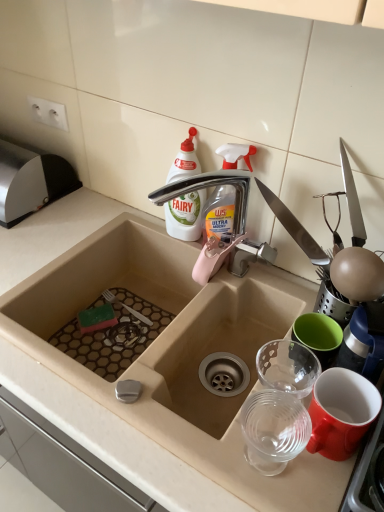
Question: From a real-world perspective, is white plastic bottle at upper center located higher than silver metallic tap at upper center?

Choices:
 (A) yes
 (B) no

Answer: (A)

Question: Is white plastic bottle at upper center touching silver metallic tap at upper center?

Choices:
 (A) yes
 (B) no

Answer: (A)

Question: Can you confirm if white plastic bottle at upper center is smaller than silver metallic tap at upper center?

Choices:
 (A) no
 (B) yes

Answer: (B)

Question: From a real-world perspective, is white plastic bottle at upper center located beneath silver metallic tap at upper center?

Choices:
 (A) no
 (B) yes

Answer: (A)

Question: Does white plastic bottle at upper center contain silver metallic tap at upper center?

Choices:
 (A) yes
 (B) no

Answer: (B)

Question: Which is correct: beige ceramic sink at center is inside white plastic bottle at upper center, or outside of it?

Choices:
 (A) inside
 (B) outside

Answer: (B)

Question: In the image, is beige ceramic sink at center on the left side or the right side of white plastic bottle at upper center?

Choices:
 (A) left
 (B) right

Answer: (A)

Question: From the image's perspective, is beige ceramic sink at center located above or below white plastic bottle at upper center?

Choices:
 (A) above
 (B) below

Answer: (B)

Question: Considering the positions of beige ceramic sink at center and white plastic bottle at upper center in the image, is beige ceramic sink at center taller or shorter than white plastic bottle at upper center?

Choices:
 (A) short
 (B) tall

Answer: (B)

Question: From the image's perspective, is silver metallic tap at upper center positioned above or below transparent plastic spray bottle at upper center?

Choices:
 (A) above
 (B) below

Answer: (B)

Question: From a real-world perspective, relative to transparent plastic spray bottle at upper center, is silver metallic tap at upper center vertically above or below?

Choices:
 (A) below
 (B) above

Answer: (A)

Question: Is silver metallic tap at upper center taller or shorter than transparent plastic spray bottle at upper center?

Choices:
 (A) short
 (B) tall

Answer: (B)

Question: In the image, is silver metallic tap at upper center positioned in front of or behind transparent plastic spray bottle at upper center?

Choices:
 (A) front
 (B) behind

Answer: (A)

Question: Is white plastic bottle at upper center bigger or smaller than transparent plastic cups at right?

Choices:
 (A) small
 (B) big

Answer: (B)

Question: From a real-world perspective, is white plastic bottle at upper center positioned above or below transparent plastic cups at right?

Choices:
 (A) above
 (B) below

Answer: (A)